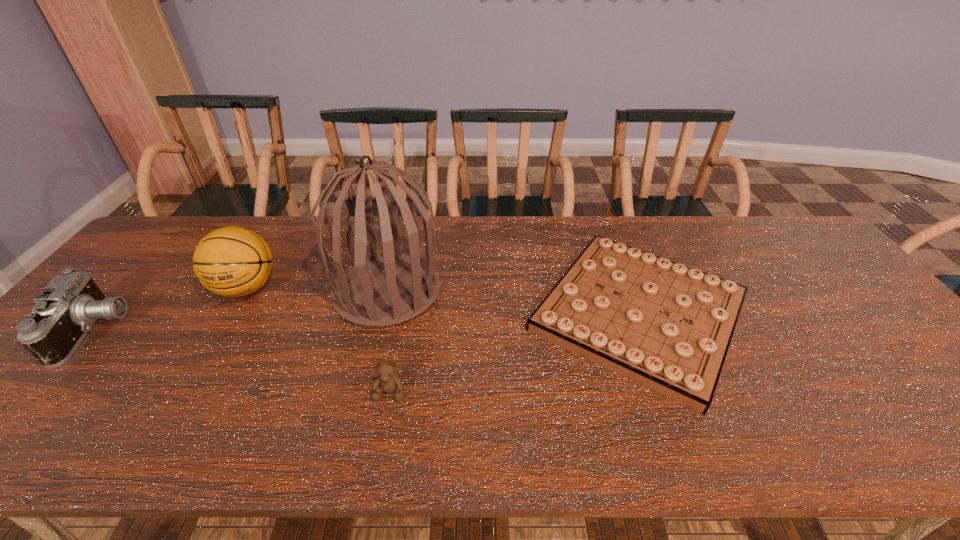
The height and width of the screenshot is (540, 960). I want to click on the tallest object, so click(x=384, y=289).

This screenshot has width=960, height=540. What are the coordinates of `the fourth object from right to left` in the screenshot? It's located at (231, 261).

Locate an element on the screen. The image size is (960, 540). the fourth shortest object is located at coordinates (231, 261).

The image size is (960, 540). What are the coordinates of `the leftmost object` in the screenshot? It's located at (70, 304).

Find the location of a particular element. The height and width of the screenshot is (540, 960). camera is located at coordinates (70, 304).

You are a GUI agent. You are given a task and a screenshot of the screen. Output one action in this format:
    pyautogui.click(x=<x>, y=<y>)
    Task: Click on the teddy bear
    The width and height of the screenshot is (960, 540).
    Given the screenshot: What is the action you would take?
    pyautogui.click(x=387, y=381)

Where is `the rightmost object`? the rightmost object is located at coordinates (668, 327).

The width and height of the screenshot is (960, 540). I want to click on the shortest object, so click(x=668, y=327).

This screenshot has width=960, height=540. Find the location of `vacant region located 0.220m on the left of the tallest object`. vacant region located 0.220m on the left of the tallest object is located at coordinates (255, 291).

Where is `vacant region located 0.180m on the surface of the fourth shortest object near the brand logo`? This screenshot has height=540, width=960. vacant region located 0.180m on the surface of the fourth shortest object near the brand logo is located at coordinates (200, 366).